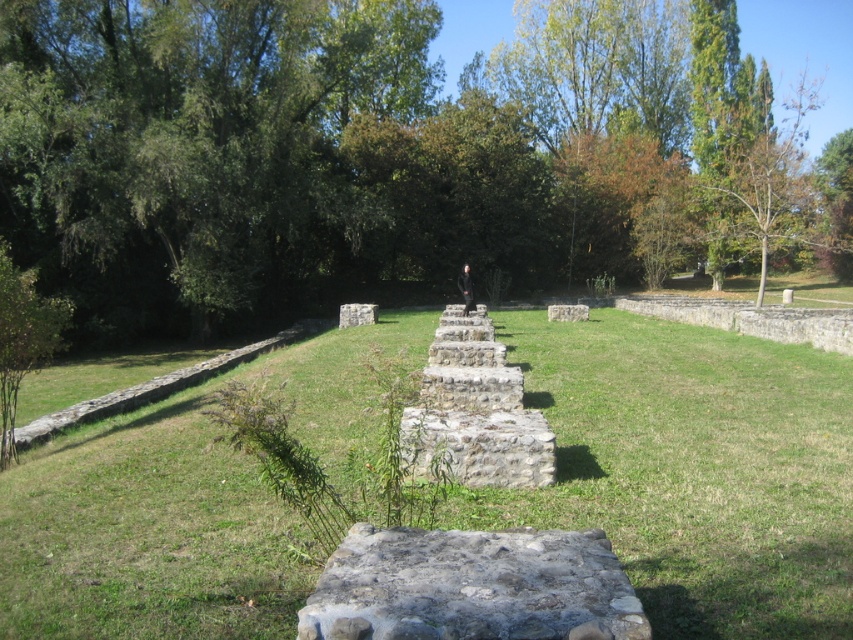
Which is below, rusty stone at center or gray stone steps at center?

rusty stone at center is below.

Who is more distant from viewer, (474, 531) or (483, 420)?

The point (483, 420) is behind.

The height and width of the screenshot is (640, 853). I want to click on rusty stone at center, so [473, 586].

Who is shorter, green leafy tree at center or gray stone wall at center?

With less height is gray stone wall at center.

Is green leafy tree at center further to the viewer compared to gray stone wall at center?

No, it is in front of gray stone wall at center.

Which is in front, point (740, 115) or point (564, 316)?

Point (564, 316) is more forward.

You are a GUI agent. You are given a task and a screenshot of the screen. Output one action in this format:
    pyautogui.click(x=<x>, y=<y>)
    Task: Click on the green leafy tree at center
    The height and width of the screenshot is (640, 853).
    Given the screenshot: What is the action you would take?
    pyautogui.click(x=383, y=154)

Is green leafy tree at center wider than green grassy at center?

Indeed, green leafy tree at center has a greater width compared to green grassy at center.

Which is above, green leafy tree at center or green grassy at center?

green leafy tree at center is higher up.

Is point (146, 45) farther from viewer compared to point (759, 410)?

Yes, it is.

Locate an element on the screen. The image size is (853, 640). green leafy tree at center is located at coordinates (383, 154).